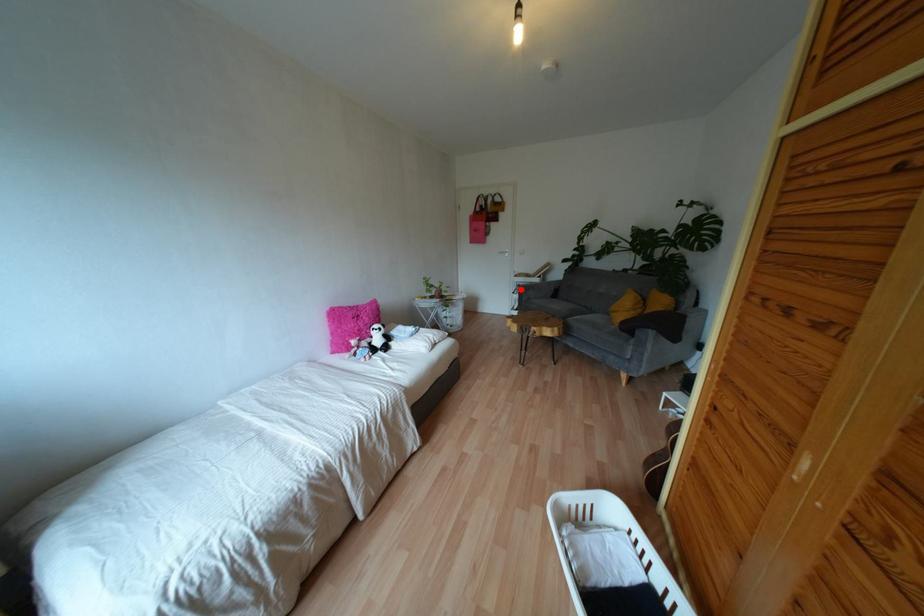
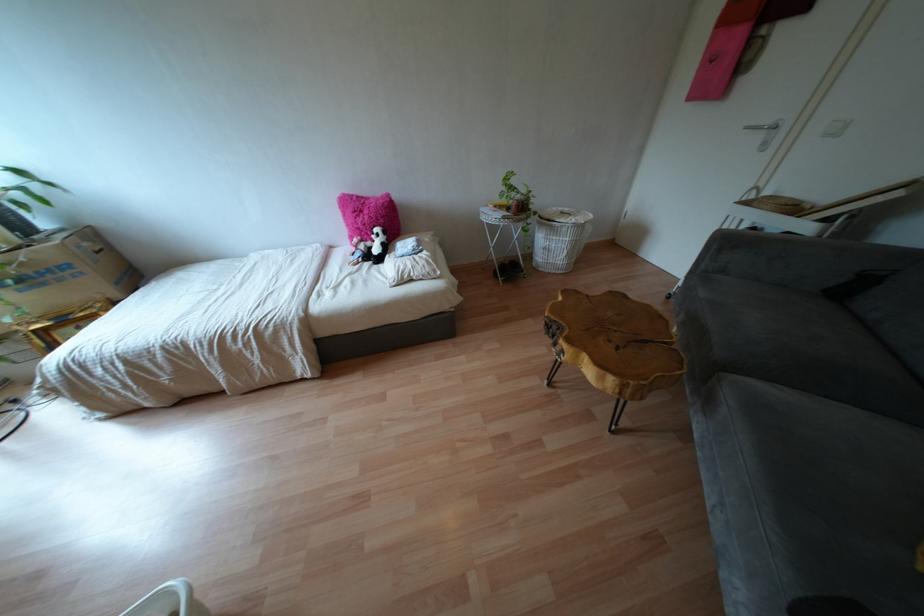
Question: I am providing you with two images of the same scene from different viewpoints. In image1, a red point is highlighted. Considering the same 3D point in image2, which of the following is correct?

Choices:
 (A) It is closer
 (B) It is farther

Answer: (B)